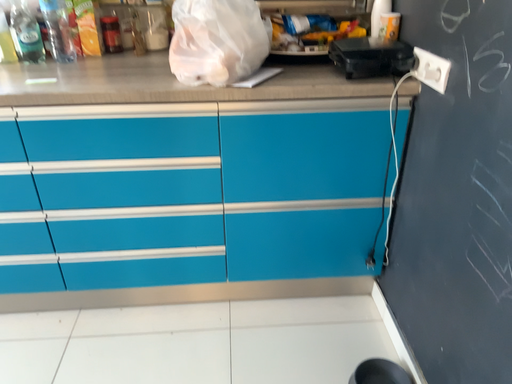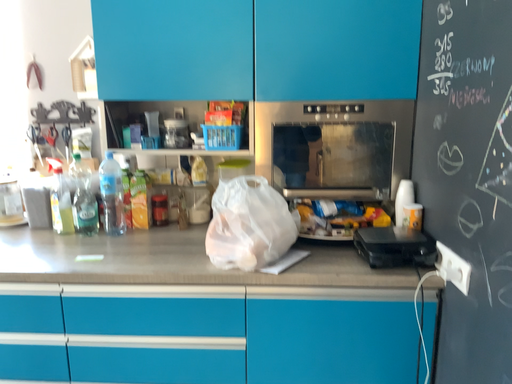
Question: How did the camera likely rotate when shooting the video?

Choices:
 (A) rotated downward
 (B) rotated upward

Answer: (B)